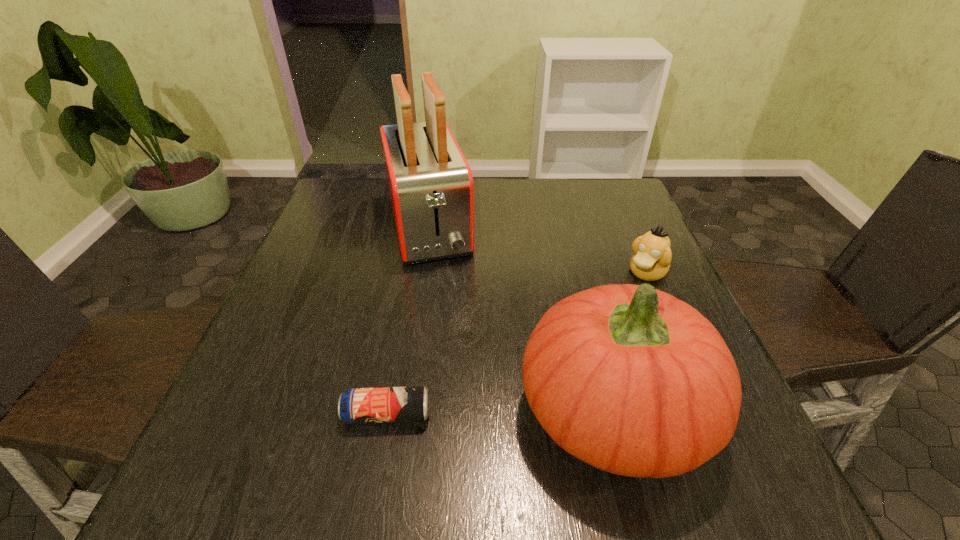
I want to click on free space on the desktop that is between the shortest object and the pumpkin and is positioned on the face of the duckling, so click(517, 411).

Locate an element on the screen. This screenshot has height=540, width=960. vacant space on the desktop that is between the shortest object and the pumpkin and is positioned on the front-facing side of the tallest object is located at coordinates (484, 412).